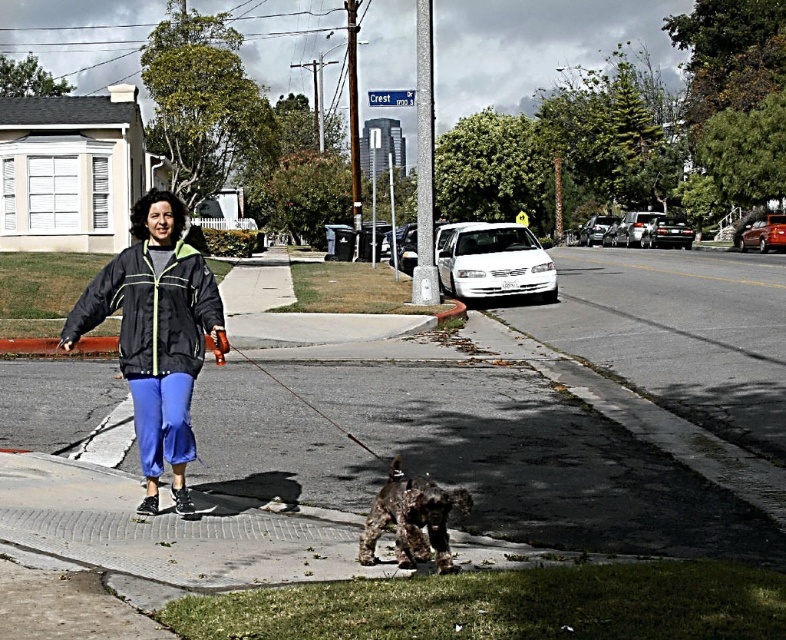
Question: Among these objects, which one is nearest to the camera?

Choices:
 (A) matte black jacket at center
 (B) gray concrete sidewalk at center
 (C) smooth black leash at center

Answer: (B)

Question: Is gray concrete sidewalk at center above matte black jacket at center?

Choices:
 (A) yes
 (B) no

Answer: (B)

Question: Where is gray concrete sidewalk at center located in relation to smooth black leash at center in the image?

Choices:
 (A) left
 (B) right

Answer: (B)

Question: Is gray concrete sidewalk at center to the left of matte black jacket at center from the viewer's perspective?

Choices:
 (A) no
 (B) yes

Answer: (A)

Question: Among these objects, which one is farthest from the camera?

Choices:
 (A) shaggy brown dog at center
 (B) smooth black leash at center

Answer: (B)

Question: Among these points, which one is nearest to the camera?

Choices:
 (A) coord(340,428)
 (B) coord(26,362)
 (C) coord(375,502)

Answer: (C)